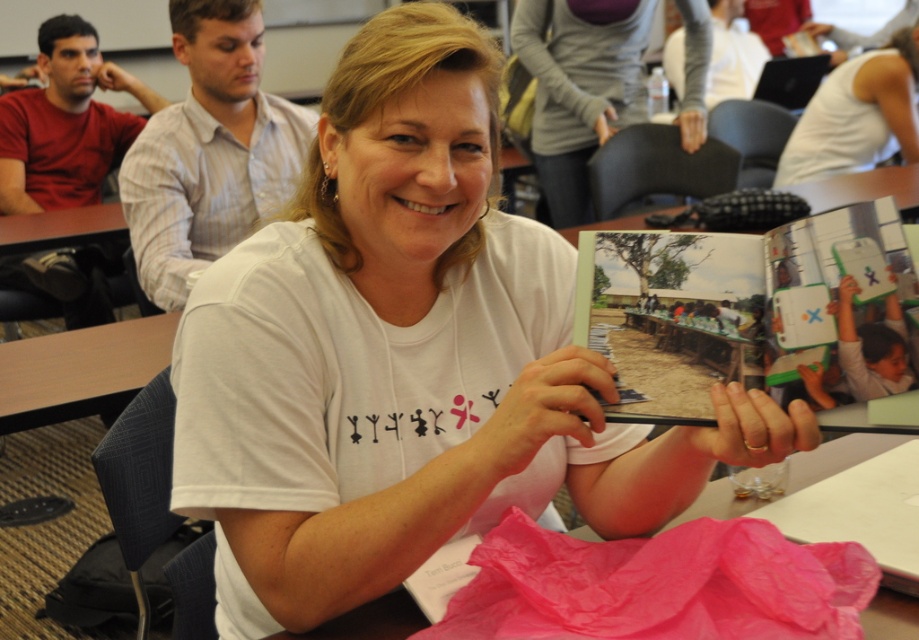
You are a student standing in front of the wooden table at lower left. You want to place a 1.5 meter long project board on the table. Can you fit it diagonally on the table?

The distance between the wooden table at lower left and the viewer is 1.66 meters. Since the project board is 1.5 meters long, it can fit diagonally on the table as the diagonal length of the table must be at least 1.5 meters. However, the actual table dimensions aren not provided, so this depends on the table shape and size. But given the distance from viewer, it might be possible.

You are a student trying to locate the wooden table at lower left and the white matte tank top at upper right in the classroom. Which object is located more to the left side of the classroom?

The wooden table at lower left is located more to the left side of the classroom than the white matte tank top at upper right.

You are a student who needs to place a notebook on the wooden table at lower left and the white matte tank top at upper right. Which object has enough space to accommodate the notebook?

The white matte tank top at upper right has a greater width than the wooden table at lower left, so it can accommodate the notebook better.